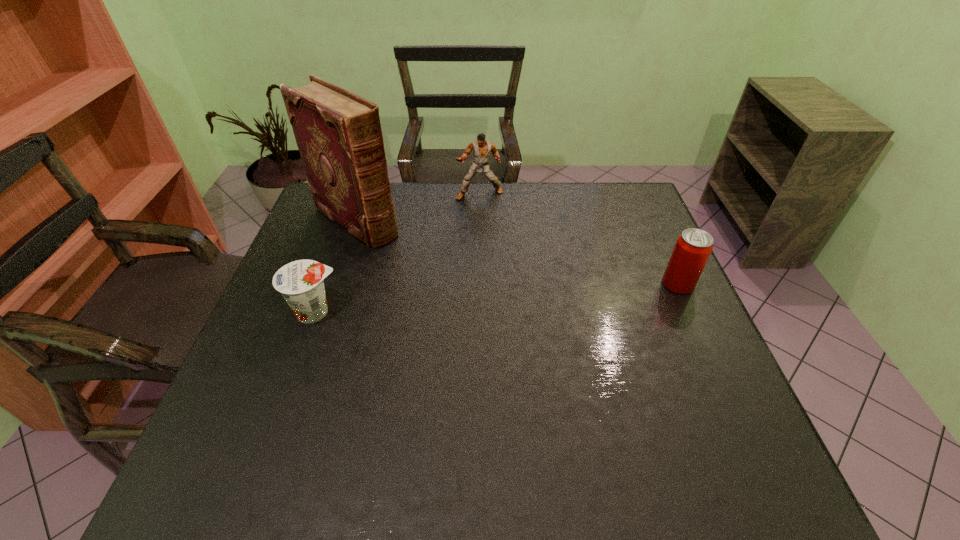
At what (x,y) coordinates should I click in order to perform the action: click on vacant space at the far edge of the desktop. Please return your answer as a coordinate pair (x, y). Image resolution: width=960 pixels, height=540 pixels. Looking at the image, I should click on (491, 213).

In the image, there is a desktop. At what (x,y) coordinates should I click in order to perform the action: click on free space at the near edge. Please return your answer as a coordinate pair (x, y). Looking at the image, I should click on (380, 401).

Find the location of `blank area at the left edge`. blank area at the left edge is located at coordinates (310, 337).

Locate an element on the screen. This screenshot has width=960, height=540. vacant space at the right edge is located at coordinates (643, 343).

I want to click on free space between the yogurt and the puncher, so click(397, 253).

At what (x,y) coordinates should I click in order to perform the action: click on vacant area that lies between the tallest object and the yogurt. Please return your answer as a coordinate pair (x, y). The height and width of the screenshot is (540, 960). Looking at the image, I should click on click(x=336, y=266).

You are a GUI agent. You are given a task and a screenshot of the screen. Output one action in this format:
    pyautogui.click(x=<x>, y=<y>)
    Task: Click on the free space between the second object from right to left and the tallest object
    Image resolution: width=960 pixels, height=540 pixels.
    Given the screenshot: What is the action you would take?
    pyautogui.click(x=418, y=207)

Find the location of a particular element. The image size is (960, 540). empty location between the yogurt and the third shortest object is located at coordinates (397, 253).

I want to click on free space between the third shortest object and the can, so click(579, 239).

Where is `vacant area that lies between the puncher and the tallest object`? The width and height of the screenshot is (960, 540). vacant area that lies between the puncher and the tallest object is located at coordinates (418, 207).